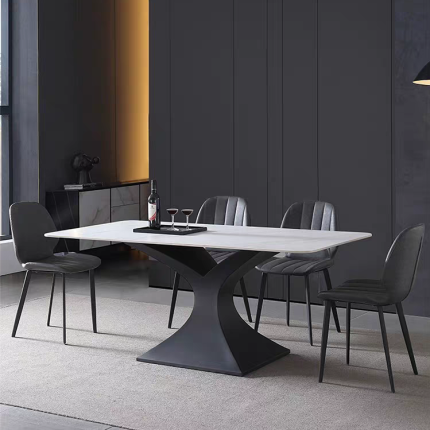
The width and height of the screenshot is (430, 430). In order to click on glass in this screenshot , I will do `click(173, 209)`, `click(185, 211)`.